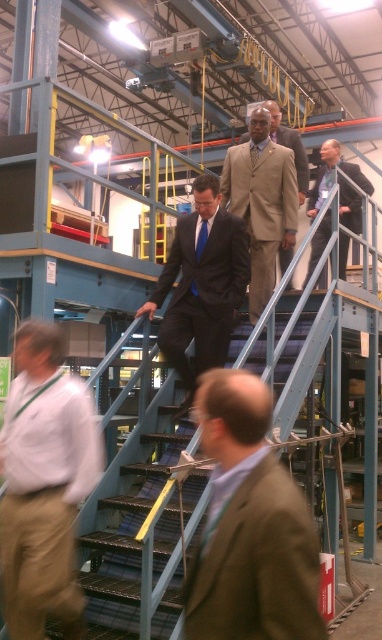
Is point (304, 314) positioned behind point (135, 314)?

Yes.

Is the position of blue metal stairs at center more distant than that of matte black suit at center?

That is False.

Is point (108, 595) positioned before point (179, 321)?

Yes, point (108, 595) is closer to viewer.

At what (x,y) coordinates should I click in order to perform the action: click on blue metal stairs at center. Please return your answer as a coordinate pair (x, y). Looking at the image, I should click on (124, 540).

Who is shorter, light brown suit at center or blue silk tie at center?

Standing shorter between the two is blue silk tie at center.

What do you see at coordinates (333, 176) in the screenshot?
I see `light brown suit at center` at bounding box center [333, 176].

Image resolution: width=382 pixels, height=640 pixels. What are the coordinates of `light brown suit at center` in the screenshot? It's located at (333, 176).

Can you confirm if beige wool suit at center is taller than blue silk tie at center?

Correct, beige wool suit at center is much taller as blue silk tie at center.

Who is more distant from viewer, (283, 172) or (197, 243)?

Point (283, 172)

You are a GUI agent. You are given a task and a screenshot of the screen. Output one action in this format:
    pyautogui.click(x=<x>, y=<y>)
    Task: Click on the beige wool suit at center
    
    Given the screenshot: What is the action you would take?
    pyautogui.click(x=262, y=209)